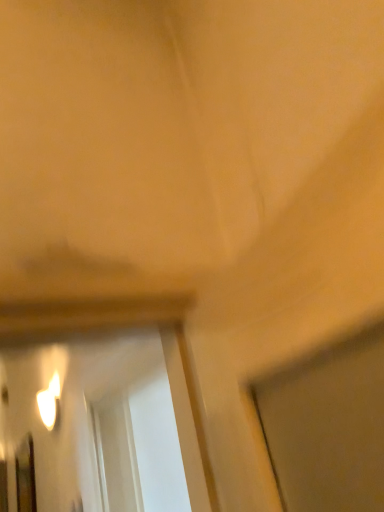
Question: Should I look upward or downward to see matte white light fixture at lower left?

Choices:
 (A) up
 (B) down

Answer: (B)